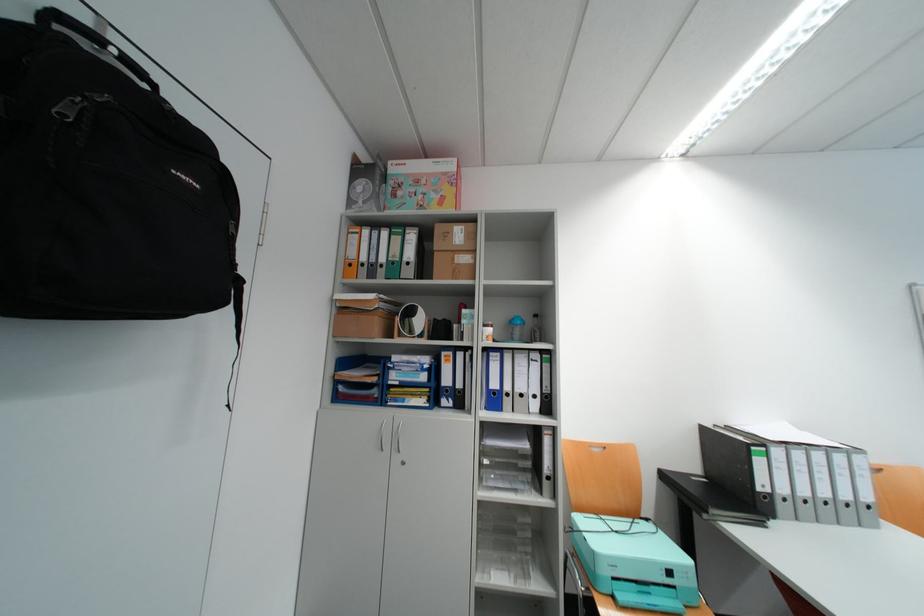
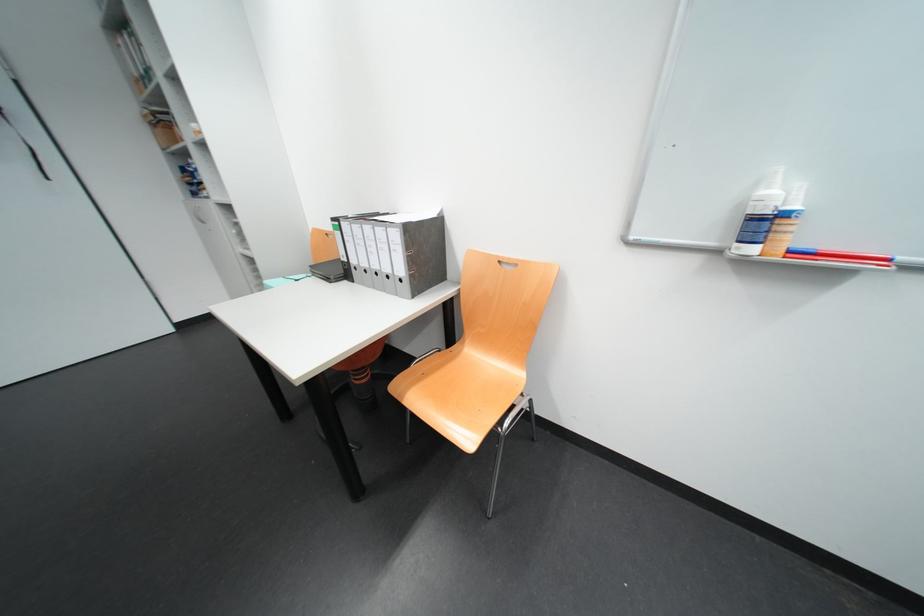
Question: I am providing you with two images of the same scene from different viewpoints. Please identify which objects are invisible in image2.

Choices:
 (A) red whiteboard marker
 (B) purple mineral sample
 (C) chair back handle
 (D) green binder spine hole

Answer: (D)